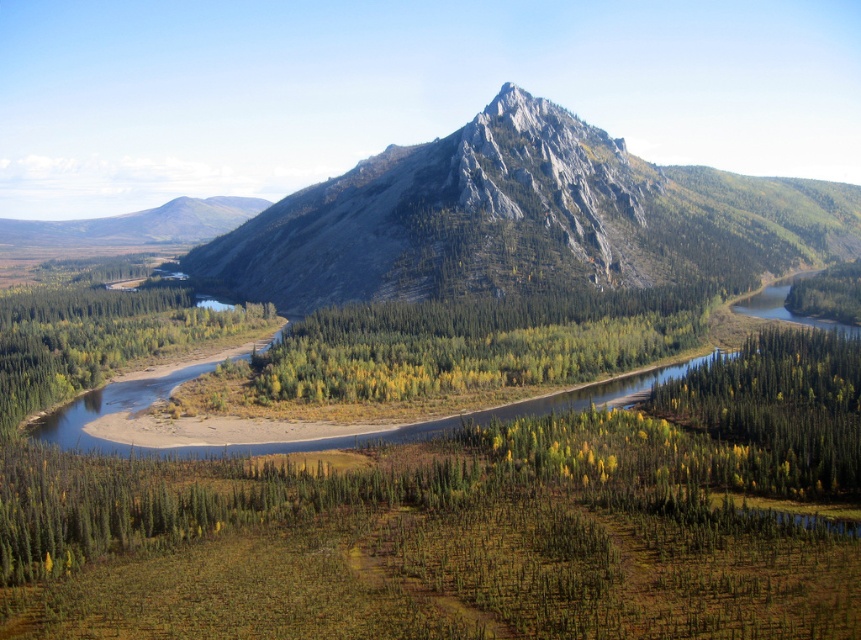
Question: Estimate the real-world distances between objects in this image. Which object is farther from the rugged gray rock at center?

Choices:
 (A) green leafy forest at center
 (B) green matte tree at lower right

Answer: (B)

Question: Does rugged gray rock at center come behind green leafy forest at center?

Choices:
 (A) no
 (B) yes

Answer: (B)

Question: Which point is farther from the camera taking this photo?

Choices:
 (A) (599, 282)
 (B) (773, 336)

Answer: (A)

Question: Which point appears farthest from the camera in this image?

Choices:
 (A) (279, 278)
 (B) (500, 365)

Answer: (A)

Question: Does rugged gray rock at center have a lesser width compared to green matte tree at lower right?

Choices:
 (A) yes
 (B) no

Answer: (B)

Question: Can you confirm if rugged gray rock at center is positioned to the left of green matte tree at lower right?

Choices:
 (A) yes
 (B) no

Answer: (B)